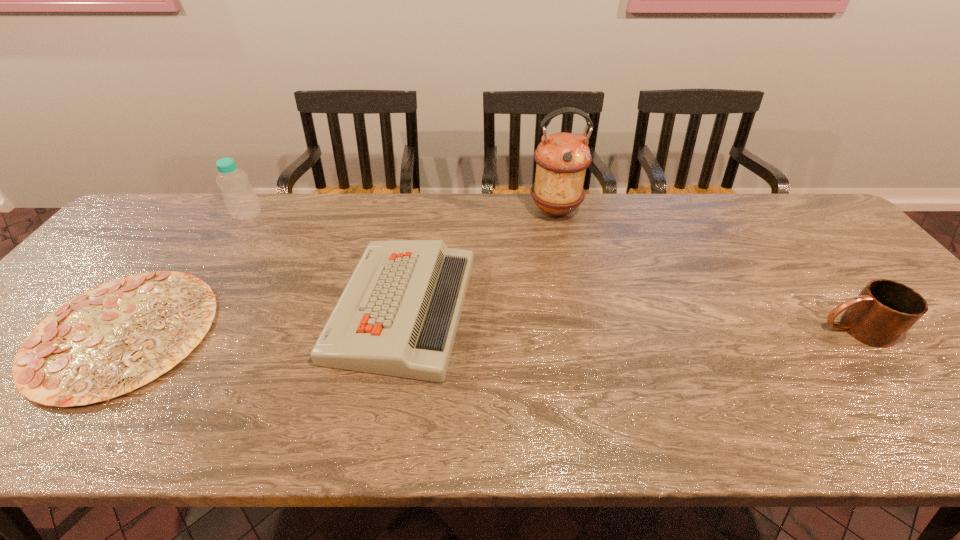
Locate an element on the screen. vacant space located on the side of the rightmost object with the handle is located at coordinates (668, 329).

Find the location of `free space located on the side of the rightmost object with the handle`. free space located on the side of the rightmost object with the handle is located at coordinates (731, 329).

Where is `vacant space located 0.050m on the back of the third object from left to right`? vacant space located 0.050m on the back of the third object from left to right is located at coordinates (414, 240).

Image resolution: width=960 pixels, height=540 pixels. What are the coordinates of `oil lamp present at the far edge` in the screenshot? It's located at (562, 158).

The image size is (960, 540). Find the location of `bottle located in the far edge section of the desktop`. bottle located in the far edge section of the desktop is located at coordinates coord(240,198).

Find the location of a particular element. object situated at the right edge is located at coordinates (885, 310).

This screenshot has width=960, height=540. Identify the location of free space at the far edge. 236,231.

Where is `free space at the near edge of the desktop`? free space at the near edge of the desktop is located at coordinates (369, 423).

This screenshot has width=960, height=540. In the image, there is a desktop. Identify the location of vacant region at the left edge. (125, 244).

The image size is (960, 540). I want to click on free space between the second object from right to left and the computer keyboard, so click(x=479, y=259).